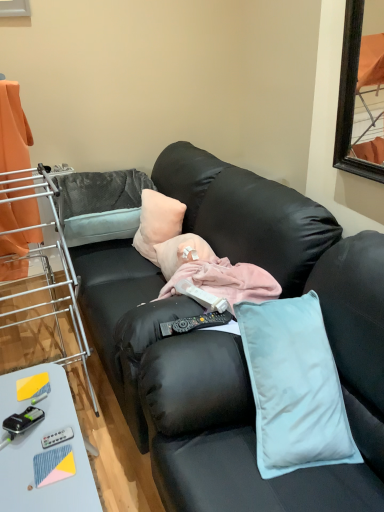
The image size is (384, 512). I want to click on free area behind black plastic remote control at lower left, the 1th equipment in the left-to-right sequence, so click(33, 393).